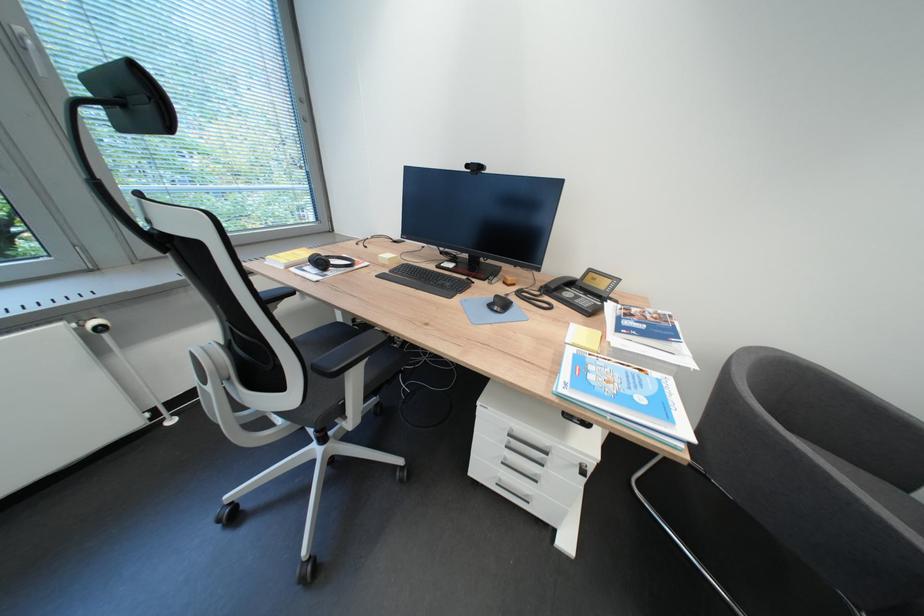
What do you see at coordinates (870, 483) in the screenshot?
I see `a gray chair sitting surface` at bounding box center [870, 483].